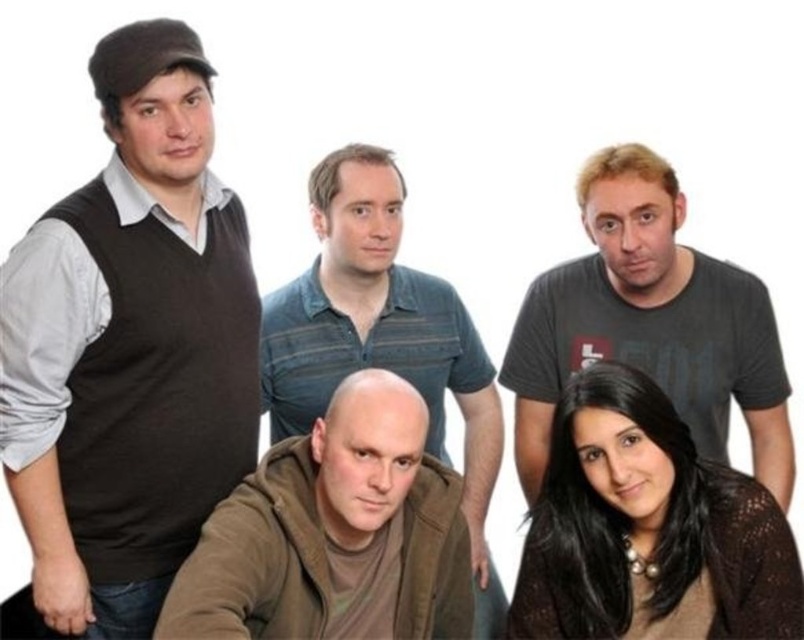
Can you confirm if brown matte hoodie at lower center is positioned to the right of brown striped shirt at center?

In fact, brown matte hoodie at lower center is to the left of brown striped shirt at center.

Find the location of a particular element. This screenshot has width=804, height=640. brown matte hoodie at lower center is located at coordinates (334, 534).

Where is `brown matte hoodie at lower center`? brown matte hoodie at lower center is located at coordinates (334, 534).

Who is more forward, (43, 301) or (485, 458)?

Point (43, 301) is in front.

Looking at this image, who is shorter, matte black sweater vest at left or brown striped shirt at center?

brown striped shirt at center is shorter.

Locate an element on the screen. matte black sweater vest at left is located at coordinates tap(129, 348).

Between point (718, 529) and point (647, 154), which one is positioned in front?

Point (718, 529)

Who is positioned more to the right, brown knitted sweater at lower right or dark gray t-shirt at upper right?

Positioned to the right is dark gray t-shirt at upper right.

Is point (671, 502) less distant than point (778, 477)?

Yes.

Find the location of a particular element. The width and height of the screenshot is (804, 640). brown knitted sweater at lower right is located at coordinates (647, 529).